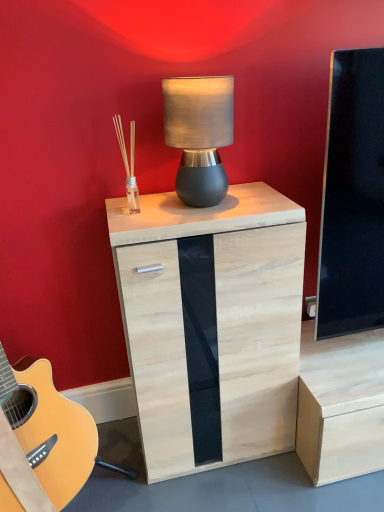
Identify the location of free space in front of matte gray lamp at center. This screenshot has width=384, height=512. (203, 215).